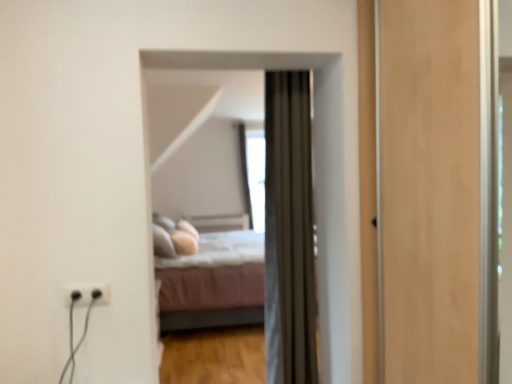
Question: Is transparent glass window at center wider or thinner than black plastic outlet at lower left?

Choices:
 (A) thin
 (B) wide

Answer: (B)

Question: From a real-world perspective, is transparent glass window at center above or below black plastic outlet at lower left?

Choices:
 (A) below
 (B) above

Answer: (B)

Question: Which of these objects is positioned closest to the transparent glass window at center?

Choices:
 (A) light pink fabric bed at center
 (B) velvet brown curtain at center
 (C) black plastic outlet at lower left

Answer: (A)

Question: Estimate the real-world distances between objects in this image. Which object is farther from the black plastic outlet at lower left?

Choices:
 (A) velvet brown curtain at center
 (B) light pink fabric bed at center
 (C) transparent glass window at center

Answer: (C)